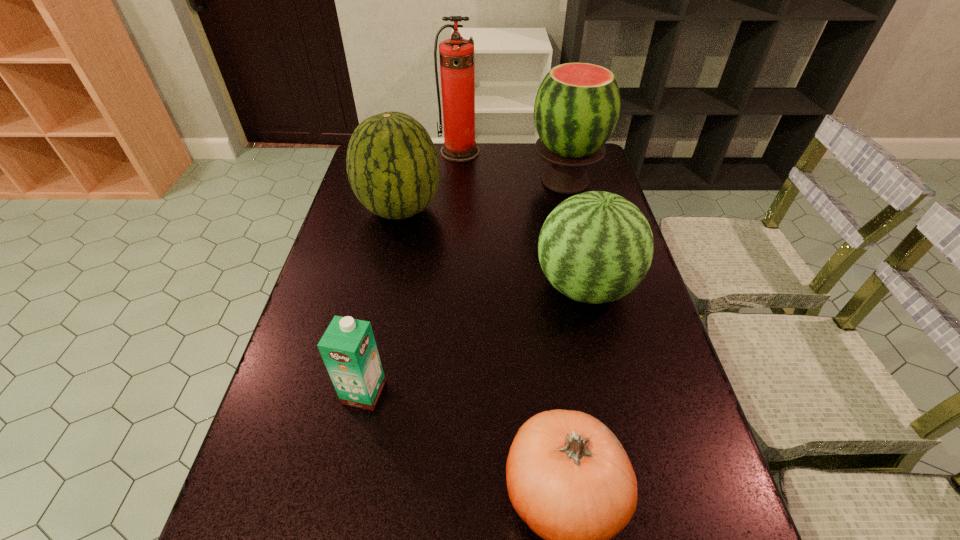
Find the location of a particular element. This screenshot has width=960, height=540. watermelon that is at the left edge is located at coordinates (392, 164).

Locate an element on the screen. The height and width of the screenshot is (540, 960). carton at the left edge is located at coordinates (348, 348).

Find the location of a particular element. This screenshot has height=540, width=960. object located in the far right corner section of the desktop is located at coordinates (577, 106).

The height and width of the screenshot is (540, 960). What are the coordinates of `vacant space at the far edge of the desktop` in the screenshot? It's located at (452, 164).

Image resolution: width=960 pixels, height=540 pixels. I want to click on vacant space at the left edge of the desktop, so click(x=311, y=294).

The width and height of the screenshot is (960, 540). Identify the location of free space at the right edge. (637, 334).

Locate an element on the screen. free space between the carton and the leftmost watermelon is located at coordinates (382, 301).

At what (x,y) coordinates should I click in order to perform the action: click on empty space that is in between the fire extinguisher and the carton. Please return your answer as a coordinate pair (x, y). This screenshot has width=960, height=540. Looking at the image, I should click on (412, 272).

The height and width of the screenshot is (540, 960). Identify the location of the fifth closest object to the third nearest object. (456, 55).

Identify which object is the nearest to the third nearest object. Please provide its 2D coordinates. Your answer should be formatted as a tuple, i.e. [(x, y)], where the tuple contains the x and y coordinates of a point satisfying the conditions above.

[(577, 106)]